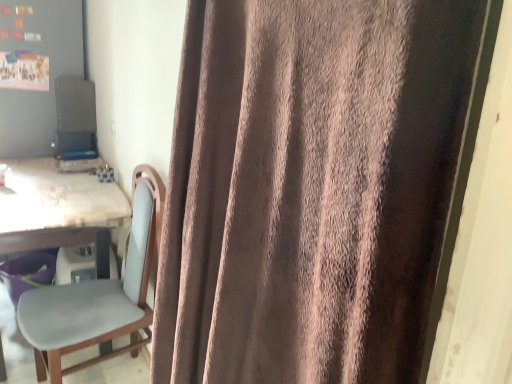
Question: Does matte gray bulletin board at upper left appear on the left side of wooden table at left?

Choices:
 (A) no
 (B) yes

Answer: (B)

Question: Is matte gray bulletin board at upper left at the right side of wooden table at left?

Choices:
 (A) yes
 (B) no

Answer: (B)

Question: Is matte gray bulletin board at upper left with wooden table at left?

Choices:
 (A) no
 (B) yes

Answer: (A)

Question: Is matte gray bulletin board at upper left facing towards wooden table at left?

Choices:
 (A) yes
 (B) no

Answer: (B)

Question: Is wooden table at left completely or partially inside matte gray bulletin board at upper left?

Choices:
 (A) no
 (B) yes

Answer: (A)

Question: Is matte gray bulletin board at upper left bigger than wooden table at left?

Choices:
 (A) yes
 (B) no

Answer: (A)

Question: From a real-world perspective, is brown velvety curtain at center positioned over matte gray bulletin board at upper left based on gravity?

Choices:
 (A) yes
 (B) no

Answer: (B)

Question: Is brown velvety curtain at center oriented towards matte gray bulletin board at upper left?

Choices:
 (A) no
 (B) yes

Answer: (A)

Question: Is brown velvety curtain at center positioned with its back to matte gray bulletin board at upper left?

Choices:
 (A) no
 (B) yes

Answer: (A)

Question: Is brown velvety curtain at center to the left of matte gray bulletin board at upper left from the viewer's perspective?

Choices:
 (A) no
 (B) yes

Answer: (A)

Question: Can you confirm if brown velvety curtain at center is wider than matte gray bulletin board at upper left?

Choices:
 (A) yes
 (B) no

Answer: (B)

Question: Does brown velvety curtain at center have a greater height compared to matte gray bulletin board at upper left?

Choices:
 (A) yes
 (B) no

Answer: (A)

Question: Is brown velvety curtain at center shorter than wooden table at left?

Choices:
 (A) yes
 (B) no

Answer: (B)